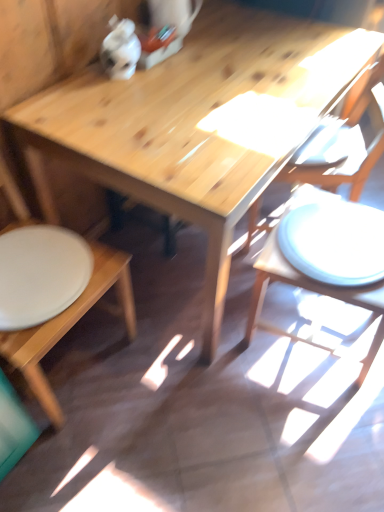
This screenshot has height=512, width=384. Find the location of `wooden chair at lower left, which is the 2th chair from right to left`. wooden chair at lower left, which is the 2th chair from right to left is located at coordinates (70, 325).

What do you see at coordinates (40, 274) in the screenshot?
I see `white matte plate at lower left` at bounding box center [40, 274].

Where is `wooden chair at lower left, positioned as the first chair in left-to-right order`? wooden chair at lower left, positioned as the first chair in left-to-right order is located at coordinates (70, 325).

Based on their sizes in the image, would you say wooden table at center is bigger or smaller than wooden chair at right, placed as the first chair when sorted from right to left?

In the image, wooden table at center appears to be larger than wooden chair at right, placed as the first chair when sorted from right to left.

Which point is more distant from viewer, (129, 190) or (372, 167)?

Point (372, 167)

I want to click on table that is under the wooden chair at right, the second chair positioned from the left (from a real-world perspective), so (192, 124).

Is wooden table at center with wooden chair at right, the second chair positioned from the left?

No, wooden table at center is not making contact with wooden chair at right, the second chair positioned from the left.

Between wooden chair at right, placed as the first chair when sorted from right to left, and white matte plate at lower left, which one has more height?

wooden chair at right, placed as the first chair when sorted from right to left, is taller.

From the image's perspective, which one is positioned higher, wooden chair at right, placed as the first chair when sorted from right to left, or white matte plate at lower left?

wooden chair at right, placed as the first chair when sorted from right to left.

Does wooden chair at right, placed as the first chair when sorted from right to left, touch white matte plate at lower left?

wooden chair at right, placed as the first chair when sorted from right to left, and white matte plate at lower left are not in contact.

Locate an element on the screen. chair in front of the wooden chair at right, the second chair positioned from the left is located at coordinates (70, 325).

Is wooden chair at right, the second chair positioned from the left, oriented towards wooden chair at lower left, which is the 2th chair from right to left?

No, wooden chair at right, the second chair positioned from the left, does not turn towards wooden chair at lower left, which is the 2th chair from right to left.

From a real-world perspective, is wooden chair at right, placed as the first chair when sorted from right to left, positioned over wooden chair at lower left, which is the 2th chair from right to left, based on gravity?

No, from a real-world perspective, wooden chair at right, placed as the first chair when sorted from right to left, is not over wooden chair at lower left, which is the 2th chair from right to left

Which is more distant, (x=325, y=175) or (x=24, y=333)?

Point (x=325, y=175)

Image resolution: width=384 pixels, height=512 pixels. Find the location of `table above the white matte plate at lower left (from the image's perspective)`. table above the white matte plate at lower left (from the image's perspective) is located at coordinates (192, 124).

From the image's perspective, is wooden table at center above white matte plate at lower left?

Yes.

Are wooden table at center and white matte plate at lower left beside each other?

No, wooden table at center is not with white matte plate at lower left.

Is wooden table at center thinner than white matte plate at lower left?

In fact, wooden table at center might be wider than white matte plate at lower left.

From the image's perspective, which one is positioned lower, white matte plate at lower left or wooden chair at right, the second chair positioned from the left?

white matte plate at lower left is shown below in the image.

Based on the photo, is white matte plate at lower left facing towards wooden chair at right, placed as the first chair when sorted from right to left?

No, white matte plate at lower left is not oriented towards wooden chair at right, placed as the first chair when sorted from right to left.

Is point (3, 281) in front of point (344, 182)?

Yes, point (3, 281) is closer to viewer.

Image resolution: width=384 pixels, height=512 pixels. I want to click on plate below the wooden table at center (from the image's perspective), so click(x=40, y=274).

Does white matte plate at lower left have a lesser width compared to wooden table at center?

Correct, the width of white matte plate at lower left is less than that of wooden table at center.

Based on their sizes in the image, would you say white matte plate at lower left is bigger or smaller than wooden table at center?

Considering their sizes, white matte plate at lower left takes up less space than wooden table at center.

Is white matte plate at lower left not close to wooden table at center?

white matte plate at lower left is actually quite close to wooden table at center.

Does wooden chair at right, placed as the first chair when sorted from right to left, have a smaller size compared to wooden table at center?

Yes, wooden chair at right, placed as the first chair when sorted from right to left, is smaller than wooden table at center.

From the image's perspective, which is below, wooden chair at right, the second chair positioned from the left, or wooden table at center?

wooden table at center.

Is wooden chair at right, the second chair positioned from the left, not within wooden table at center?

No.

How many degrees apart are the facing directions of wooden chair at right, placed as the first chair when sorted from right to left, and wooden table at center?

The facing directions of wooden chair at right, placed as the first chair when sorted from right to left, and wooden table at center are 148 degrees apart.

Identify the location of table below the wooden chair at right, the second chair positioned from the left (from the image's perspective). (192, 124).

From the image's perspective, which chair is the 2nd one above the white matte plate at lower left? Please provide its 2D coordinates.

[(351, 154)]

When comparing their distances from wooden table at center, does wooden chair at right, placed as the first chair when sorted from right to left, or white matte plate at lower left seem further?

Based on the image, wooden chair at right, placed as the first chair when sorted from right to left, appears to be further to wooden table at center.

When comparing their distances from white matte plate at lower left, does wooden chair at right, placed as the first chair when sorted from right to left, or wooden chair at lower left, which is the 2th chair from right to left, seem further?

The object further to white matte plate at lower left is wooden chair at right, placed as the first chair when sorted from right to left.

Which object lies further to the anchor point wooden chair at lower left, which is the 2th chair from right to left, wooden chair at right, placed as the first chair when sorted from right to left, or white matte plate at lower left?

Based on the image, wooden chair at right, placed as the first chair when sorted from right to left, appears to be further to wooden chair at lower left, which is the 2th chair from right to left.

Looking at this image, when comparing their distances from wooden table at center, does white matte plate at lower left or wooden chair at lower left, which is the 2th chair from right to left, seem further?

wooden chair at lower left, which is the 2th chair from right to left.

Based on their spatial positions, is wooden table at center or wooden chair at lower left, positioned as the first chair in left-to-right order, closer to white matte plate at lower left?

wooden chair at lower left, positioned as the first chair in left-to-right order, lies closer to white matte plate at lower left than the other object.

When comparing their distances from wooden chair at lower left, positioned as the first chair in left-to-right order, does wooden table at center or wooden chair at right, placed as the first chair when sorted from right to left, seem further?

wooden chair at right, placed as the first chair when sorted from right to left, is positioned further to the anchor wooden chair at lower left, positioned as the first chair in left-to-right order.

Which object lies nearer to the anchor point wooden chair at right, the second chair positioned from the left, white matte plate at lower left or wooden table at center?

wooden table at center is closer to wooden chair at right, the second chair positioned from the left.

When comparing their distances from wooden table at center, does wooden chair at lower left, positioned as the first chair in left-to-right order, or white matte plate at lower left seem further?

wooden chair at lower left, positioned as the first chair in left-to-right order, is further to wooden table at center.

This screenshot has width=384, height=512. I want to click on plate between wooden chair at lower left, which is the 2th chair from right to left, and wooden chair at right, placed as the first chair when sorted from right to left, in the horizontal direction, so click(40, 274).

Locate an element on the screen. The image size is (384, 512). plate located between wooden chair at lower left, which is the 2th chair from right to left, and wooden table at center in the left-right direction is located at coordinates (40, 274).

Locate an element on the screen. This screenshot has width=384, height=512. table between white matte plate at lower left and wooden chair at right, the second chair positioned from the left, from left to right is located at coordinates (192, 124).

The width and height of the screenshot is (384, 512). I want to click on table between wooden chair at lower left, which is the 2th chair from right to left, and wooden chair at right, the second chair positioned from the left, so click(x=192, y=124).